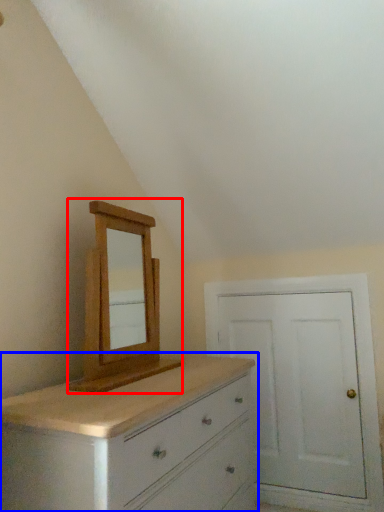
Question: Which object appears closest to the camera in this image, medicine cabinet (highlighted by a red box) or chest of drawers (highlighted by a blue box)?

Choices:
 (A) medicine cabinet
 (B) chest of drawers

Answer: (B)